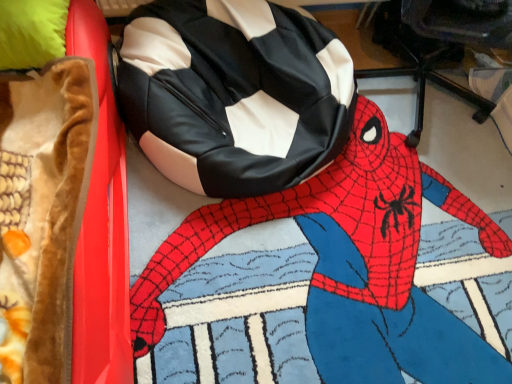
Question: Considering the positions of black leather bean bag at upper center and velvet brown blanket at left in the image, is black leather bean bag at upper center bigger or smaller than velvet brown blanket at left?

Choices:
 (A) big
 (B) small

Answer: (B)

Question: Based on their positions, is black leather bean bag at upper center located to the left or right of velvet brown blanket at left?

Choices:
 (A) left
 (B) right

Answer: (B)

Question: Based on their relative distances, which object is farther from the velvet brown blanket at left?

Choices:
 (A) black leather bean bag chair at center
 (B) black leather bean bag at upper center

Answer: (B)

Question: Considering the real-world distances, which object is closest to the black leather bean bag chair at center?

Choices:
 (A) velvet brown blanket at left
 (B) black leather bean bag at upper center

Answer: (B)